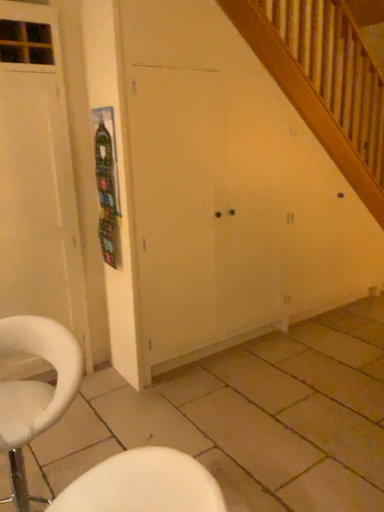
Question: From a real-world perspective, is beige tile at lower center on white matte cabinet at center?

Choices:
 (A) yes
 (B) no

Answer: (B)

Question: Considering the relative sizes of beige tile at lower center and white matte cabinet at center in the image provided, is beige tile at lower center smaller than white matte cabinet at center?

Choices:
 (A) yes
 (B) no

Answer: (A)

Question: From the image's perspective, is beige tile at lower center beneath white matte cabinet at center?

Choices:
 (A) yes
 (B) no

Answer: (A)

Question: From the image's perspective, is beige tile at lower center on top of white matte cabinet at center?

Choices:
 (A) no
 (B) yes

Answer: (A)

Question: Would you consider beige tile at lower center to be distant from white matte cabinet at center?

Choices:
 (A) yes
 (B) no

Answer: (B)

Question: In the image, is white wood door at left positioned in front of or behind white fabric chair at lower left?

Choices:
 (A) behind
 (B) front

Answer: (A)

Question: Based on their sizes in the image, would you say white wood door at left is bigger or smaller than white fabric chair at lower left?

Choices:
 (A) small
 (B) big

Answer: (B)

Question: In terms of width, does white wood door at left look wider or thinner when compared to white fabric chair at lower left?

Choices:
 (A) wide
 (B) thin

Answer: (A)

Question: Based on their positions, is white wood door at left located to the left or right of white fabric chair at lower left?

Choices:
 (A) right
 (B) left

Answer: (B)

Question: Based on their positions, is white wood door at left located to the left or right of beige tile at lower center?

Choices:
 (A) left
 (B) right

Answer: (A)

Question: From the image's perspective, is white wood door at left positioned above or below beige tile at lower center?

Choices:
 (A) above
 (B) below

Answer: (A)

Question: From a real-world perspective, is white wood door at left above or below beige tile at lower center?

Choices:
 (A) below
 (B) above

Answer: (B)

Question: Considering the positions of white wood door at left and beige tile at lower center in the image, is white wood door at left taller or shorter than beige tile at lower center?

Choices:
 (A) tall
 (B) short

Answer: (A)

Question: In the image, is metallic silver poster at upper left positioned in front of or behind beige tile at lower center?

Choices:
 (A) front
 (B) behind

Answer: (B)

Question: In terms of size, does metallic silver poster at upper left appear bigger or smaller than beige tile at lower center?

Choices:
 (A) small
 (B) big

Answer: (A)